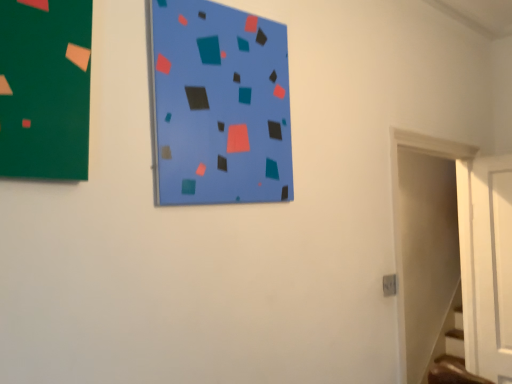
Question: Could you tell me if white wooden door at right is facing blue matte bulletin board at center?

Choices:
 (A) yes
 (B) no

Answer: (B)

Question: From a real-world perspective, is white wooden door at right beneath blue matte bulletin board at center?

Choices:
 (A) no
 (B) yes

Answer: (B)

Question: Is white wooden door at right placed right next to blue matte bulletin board at center?

Choices:
 (A) no
 (B) yes

Answer: (A)

Question: From the image's perspective, is white wooden door at right located beneath blue matte bulletin board at center?

Choices:
 (A) no
 (B) yes

Answer: (B)

Question: Considering the relative sizes of white wooden door at right and blue matte bulletin board at center in the image provided, is white wooden door at right wider than blue matte bulletin board at center?

Choices:
 (A) yes
 (B) no

Answer: (A)

Question: Considering the relative positions of white wooden door at right and blue matte bulletin board at center in the image provided, is white wooden door at right to the left of blue matte bulletin board at center from the viewer's perspective?

Choices:
 (A) yes
 (B) no

Answer: (B)

Question: Considering the relative sizes of blue matte bulletin board at center and white wooden door at right in the image provided, is blue matte bulletin board at center taller than white wooden door at right?

Choices:
 (A) yes
 (B) no

Answer: (B)

Question: Is blue matte bulletin board at center shorter than white wooden door at right?

Choices:
 (A) no
 (B) yes

Answer: (B)

Question: From a real-world perspective, is blue matte bulletin board at center located higher than white wooden door at right?

Choices:
 (A) no
 (B) yes

Answer: (B)

Question: Considering the relative sizes of blue matte bulletin board at center and white wooden door at right in the image provided, is blue matte bulletin board at center smaller than white wooden door at right?

Choices:
 (A) no
 (B) yes

Answer: (B)

Question: From the image's perspective, is blue matte bulletin board at center below white wooden door at right?

Choices:
 (A) yes
 (B) no

Answer: (B)

Question: Is the depth of blue matte bulletin board at center greater than that of white wooden door at right?

Choices:
 (A) no
 (B) yes

Answer: (A)

Question: From their relative heights in the image, would you say white wooden door at right is taller or shorter than blue matte bulletin board at center?

Choices:
 (A) tall
 (B) short

Answer: (A)